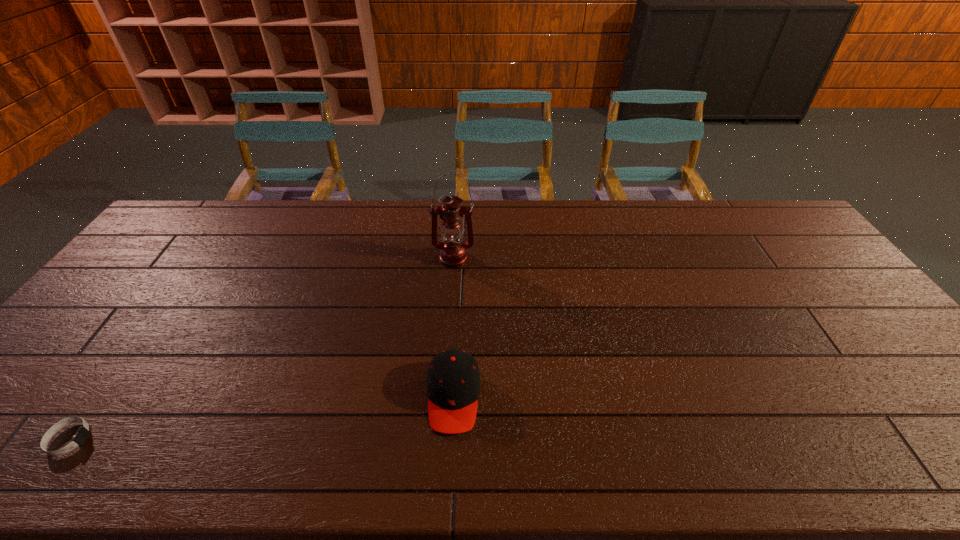
This screenshot has height=540, width=960. I want to click on object present at the left edge, so click(x=82, y=434).

Locate an element on the screen. Image resolution: width=960 pixels, height=540 pixels. object that is at the near left corner is located at coordinates (82, 434).

The image size is (960, 540). What are the coordinates of `vacant space at the far edge of the desktop` in the screenshot? It's located at (467, 230).

In the image, there is a desktop. Identify the location of free space at the near edge. coord(399,455).

Find the location of `vacant space at the left edge of the desktop`. vacant space at the left edge of the desktop is located at coordinates (49, 367).

At what (x,y) coordinates should I click in order to perform the action: click on free space at the right edge of the desktop. Please return your answer as a coordinate pair (x, y). This screenshot has height=540, width=960. Looking at the image, I should click on (775, 252).

In the image, there is a desktop. Identify the location of blank space at the near left corner. The image size is (960, 540). (4, 437).

This screenshot has width=960, height=540. Identify the location of free space that is in between the farthest object and the cap. (453, 327).

This screenshot has width=960, height=540. Identify the location of vacant area between the shortest object and the tallest object. click(261, 349).

I want to click on vacant space that is in between the cap and the oil lamp, so click(x=453, y=327).